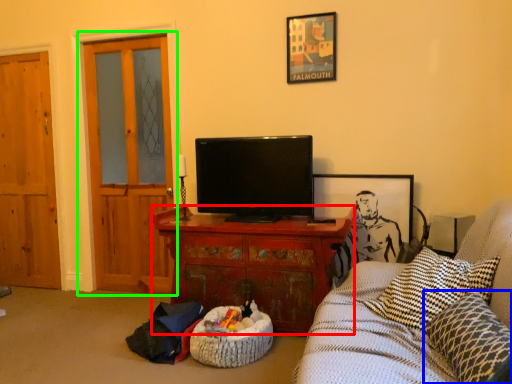
Question: Which object is positioned farthest from cabinetry (highlighted by a red box)? Select from pillow (highlighted by a blue box) and door (highlighted by a green box).

Choices:
 (A) pillow
 (B) door

Answer: (A)